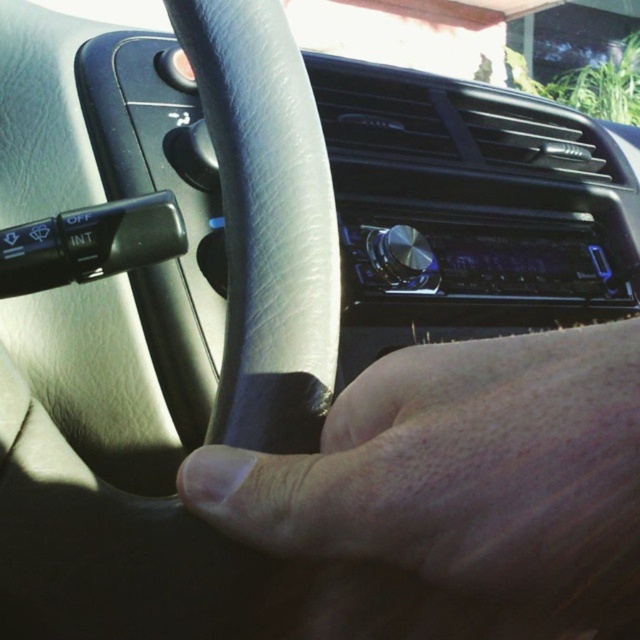
Question: Which point is farther to the camera?

Choices:
 (A) (189, 458)
 (B) (337, 336)

Answer: (B)

Question: From the image, what is the correct spatial relationship of leather at center in relation to gray leather steering wheel at center?

Choices:
 (A) above
 (B) below

Answer: (B)

Question: Does leather at center have a smaller size compared to gray leather steering wheel at center?

Choices:
 (A) no
 (B) yes

Answer: (A)

Question: Is leather at center further to the viewer compared to gray leather steering wheel at center?

Choices:
 (A) no
 (B) yes

Answer: (A)

Question: Among these points, which one is nearest to the camera?

Choices:
 (A) [458, 360]
 (B) [186, 20]

Answer: (A)